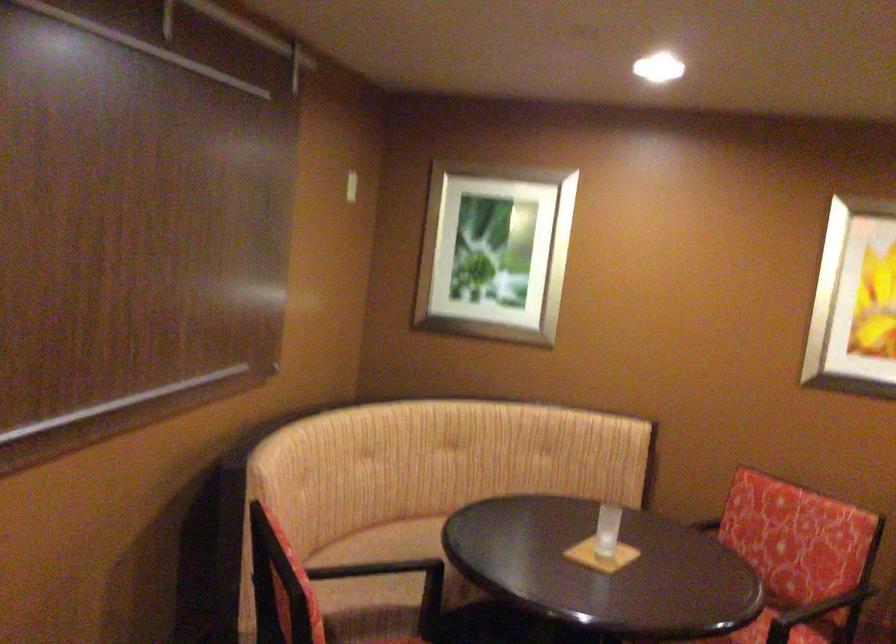
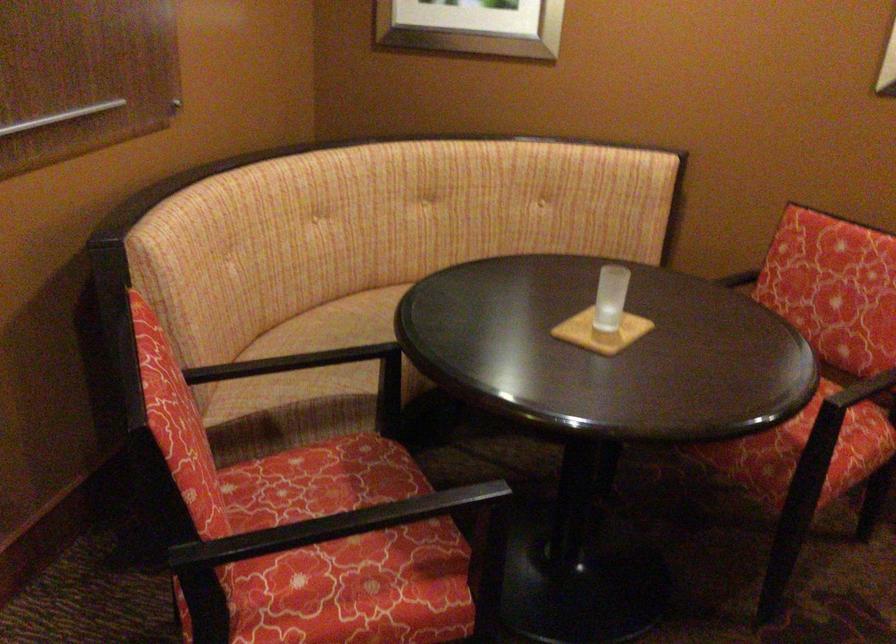
In the second image, find the point that corresponds to pixel 369 554 in the first image.

(332, 327)